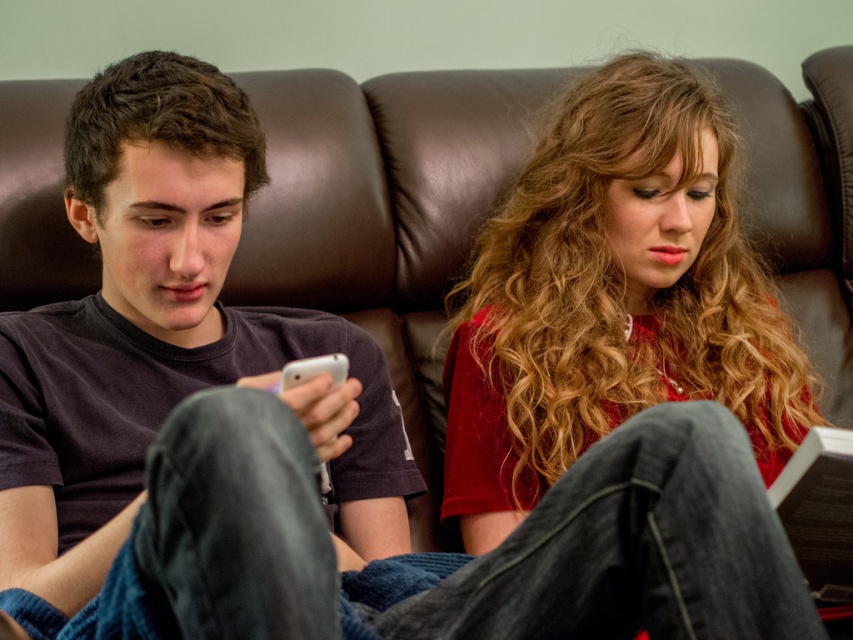
You are a delivery robot with a 10 inch wide package. You need to place it between the matte black phone at left and the white glossy smartphone at center. Can you fit the package between them?

The distance between the matte black phone at left and the white glossy smartphone at center is 9.77 inches. Since the package is 10 inches wide, it cannot fit in the space between them.

You are a photographer taking a picture of the scene. You notice the matte black phone at left and the matte red shirt at center. Which object should you adjust to ensure both are fully visible in the frame?

The matte black phone at left is located above the matte red shirt at center. To ensure both are fully visible in the frame, you should adjust the matte black phone at left to move it downward or the matte red shirt at center to move it upward so they are positioned closer to each other vertically.

You are standing at point (99, 218) and want to hand a book to someone who is 40 inches away from you. Is the person you want to give the book to within reach?

The distance between point (99, 218) and the viewer is 35.10 inches, so the person you want to give the book to is 40 inches away, which is beyond the reach. You cannot hand them the book directly.